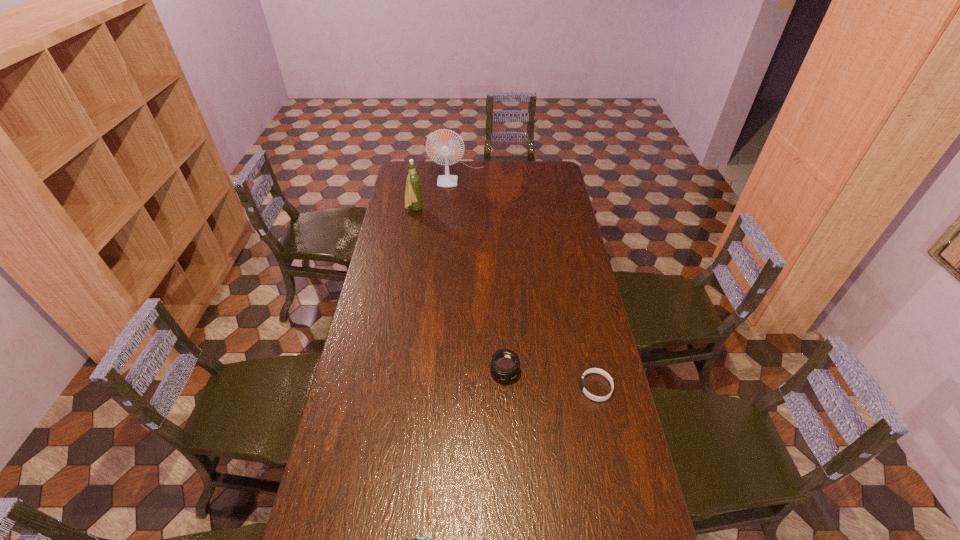
Find the location of a particular element. blank region between the second object from right to left and the farthest object is located at coordinates (481, 273).

Identify the location of unoccupied area between the leftmost object and the fan. This screenshot has width=960, height=540. (436, 192).

You are a GUI agent. You are given a task and a screenshot of the screen. Output one action in this format:
    pyautogui.click(x=<x>, y=<y>)
    Task: Click on the vacant space that is in between the second shortest object and the leftmost object
    
    Given the screenshot: What is the action you would take?
    pyautogui.click(x=505, y=299)

What are the coordinates of `free space between the farthest object and the rightmost object` in the screenshot? It's located at (527, 281).

Where is `free space between the farthest object and the second object from right to left`? free space between the farthest object and the second object from right to left is located at coordinates (481, 273).

The height and width of the screenshot is (540, 960). Identify the location of empty space that is in between the telephoto lens and the right wristband. (550, 380).

I want to click on free space between the telephoto lens and the taller wristband, so click(x=550, y=380).

Identify which object is the closest to the fourth tallest object. Please provide its 2D coordinates. Your answer should be formatted as a tuple, i.e. [(x, y)], where the tuple contains the x and y coordinates of a point satisfying the conditions above.

[(504, 365)]

This screenshot has width=960, height=540. I want to click on object that ranks as the third closest to the shorter wristband, so click(x=413, y=194).

Locate an element on the screen. free space that satisfies the following two spatial constraints: 1. on the front-facing side of the fan; 2. on the front-facing side of the wine bottle is located at coordinates (455, 210).